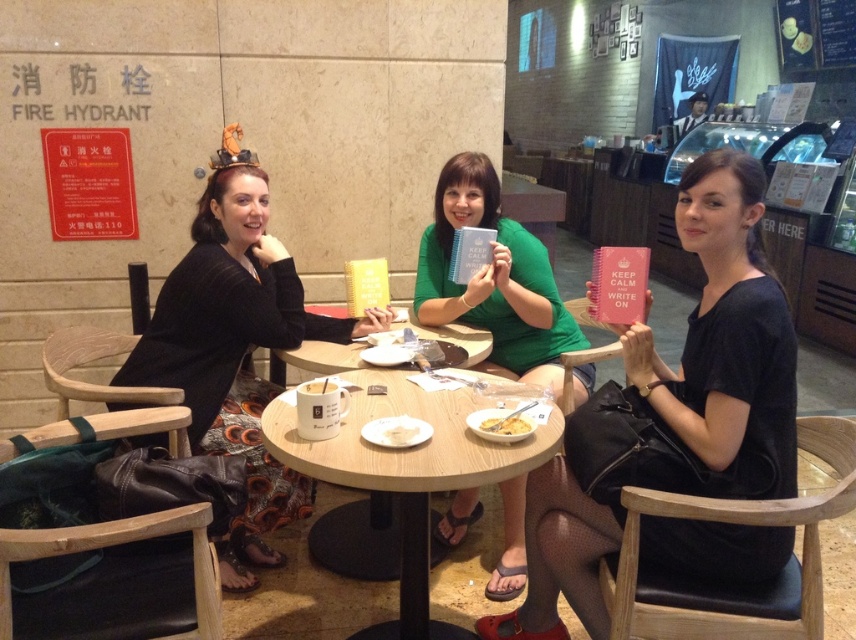
Is matte black notebook at center further to camera compared to yellow creamy food at center?

No, matte black notebook at center is closer to the viewer.

Who is more forward, (557, 532) or (496, 419)?

Point (557, 532)

Where is `matte black notebook at center`? This screenshot has width=856, height=640. matte black notebook at center is located at coordinates (670, 410).

At what (x,y) coordinates should I click in order to perform the action: click on matte black notebook at center. Please return your answer as a coordinate pair (x, y). The image size is (856, 640). Looking at the image, I should click on (670, 410).

Between wooden table at center and white creamy dessert at center, which one appears on the left side from the viewer's perspective?

Positioned to the left is white creamy dessert at center.

Does wooden table at center have a greater width compared to white creamy dessert at center?

Yes, wooden table at center is wider than white creamy dessert at center.

What do you see at coordinates (407, 472) in the screenshot? This screenshot has width=856, height=640. I see `wooden table at center` at bounding box center [407, 472].

Identify the location of wooden table at center. The width and height of the screenshot is (856, 640). (407, 472).

Between yellow creamy food at center and white matte mug at center, which one has more height?

With more height is yellow creamy food at center.

Describe the element at coordinates (504, 426) in the screenshot. I see `yellow creamy food at center` at that location.

Where is `yellow creamy food at center`? The height and width of the screenshot is (640, 856). yellow creamy food at center is located at coordinates (504, 426).